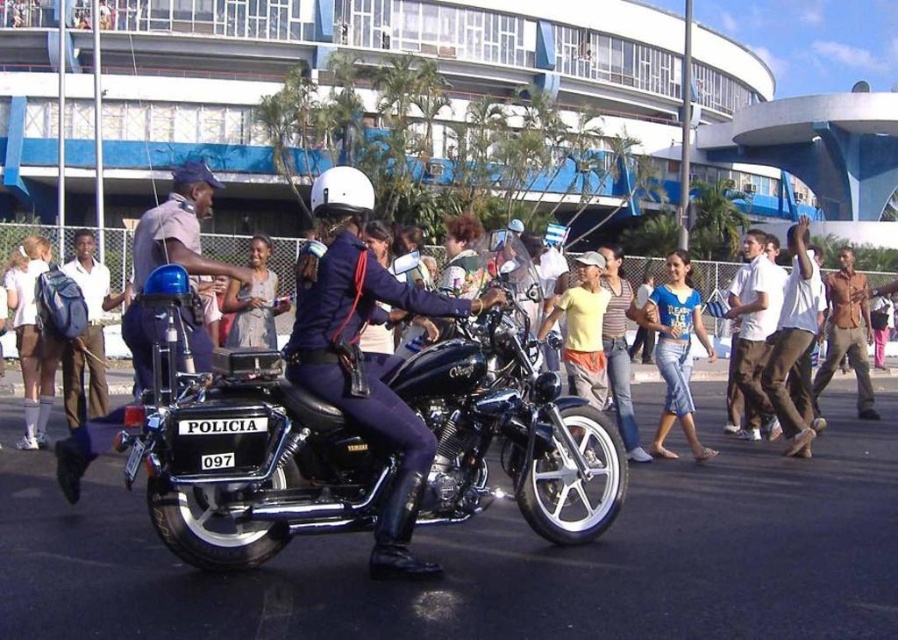
Question: Does shiny black motorcycle at center appear under blue denim jeans at center?

Choices:
 (A) yes
 (B) no

Answer: (A)

Question: Which object is closer to the camera taking this photo?

Choices:
 (A) brown leather shirt at right
 (B) shiny black motorcycle at center
 (C) blue denim jeans at center

Answer: (B)

Question: Among these points, which one is nearest to the camera?

Choices:
 (A) (322, 192)
 (B) (305, 417)
 (C) (791, 280)

Answer: (B)

Question: Is dark blue uniform at center behind white cotton shirt at right?

Choices:
 (A) no
 (B) yes

Answer: (A)

Question: Which object is farther from the camera taking this photo?

Choices:
 (A) brown leather shirt at right
 (B) shiny black motorcycle at center
 (C) white cotton shirt at right

Answer: (A)

Question: Does dark blue uniform at center have a larger size compared to white cotton shirt at right?

Choices:
 (A) yes
 (B) no

Answer: (A)